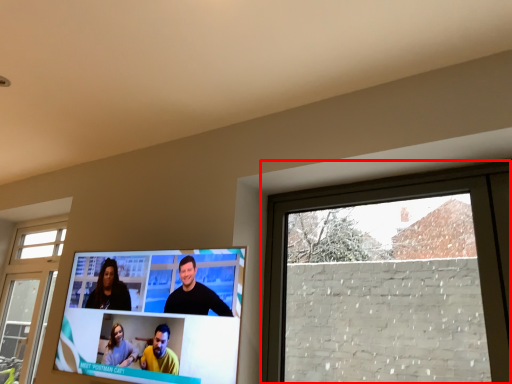
Question: From the image's perspective, what is the correct spatial positioning of window (annotated by the red box) in reference to television?

Choices:
 (A) below
 (B) above

Answer: (B)